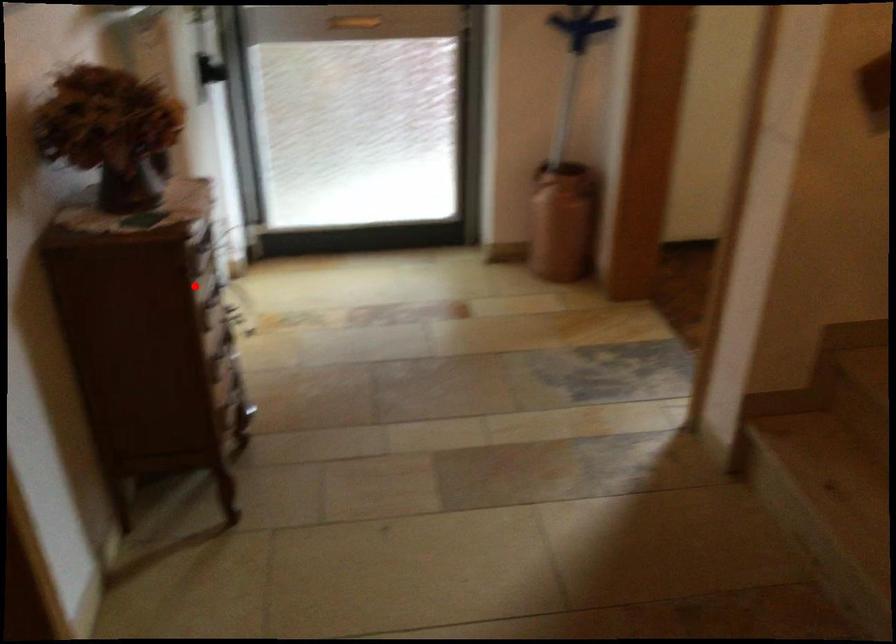
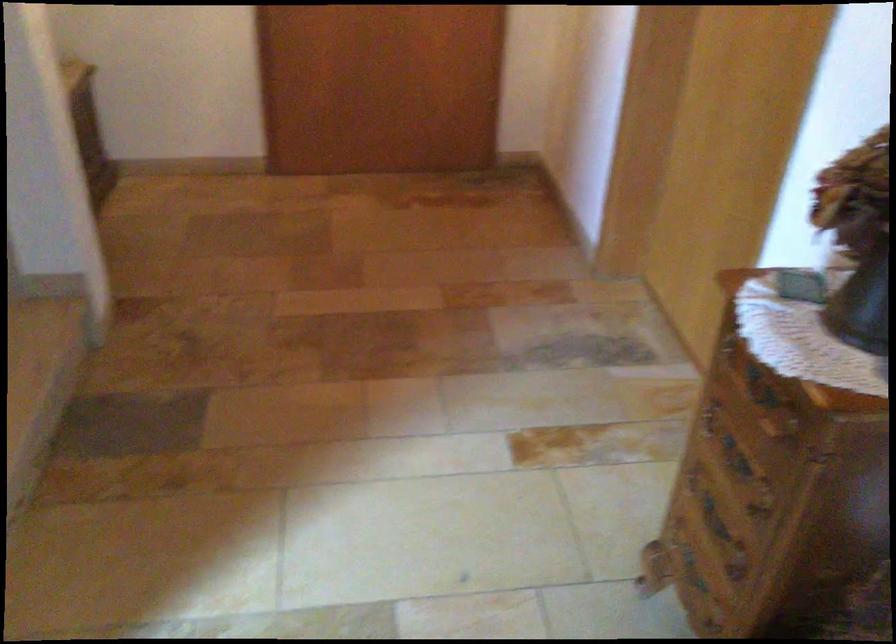
Question: A red point is marked in image1. In image2, is the corresponding 3D point closer to the camera or farther? Reply with the corresponding letter.

Choices:
 (A) The corresponding 3D point is closer.
 (B) The corresponding 3D point is farther.

Answer: (A)